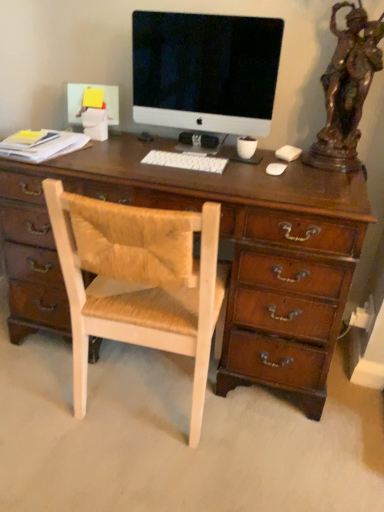
Question: Choose the correct answer: Is bronze statue at right inside satin black monitor at center or outside it?

Choices:
 (A) outside
 (B) inside

Answer: (A)

Question: Is point (340, 70) closer or farther from the camera than point (178, 37)?

Choices:
 (A) farther
 (B) closer

Answer: (B)

Question: Based on their relative distances, which object is farther from the light wood woven chair at center?

Choices:
 (A) satin black monitor at center
 (B) white plastic keyboard at center
 (C) bronze statue at right

Answer: (A)

Question: Considering the real-world distances, which object is closest to the satin black monitor at center?

Choices:
 (A) white plastic keyboard at center
 (B) bronze statue at right
 (C) light wood woven chair at center

Answer: (A)